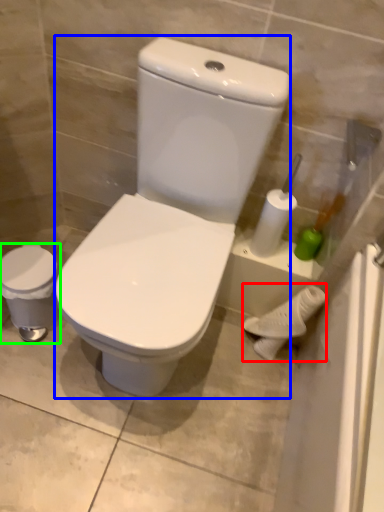
Question: Which object is the farthest from porcelain (highlighted by a red box)? Choose among these: porcelain (highlighted by a blue box) or porcelain (highlighted by a green box).

Choices:
 (A) porcelain
 (B) porcelain

Answer: (B)